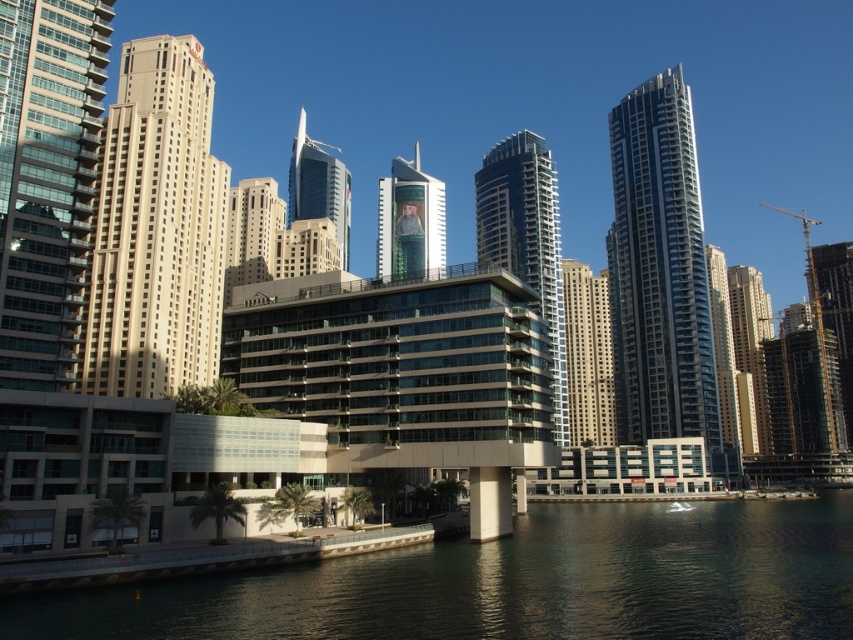
In the scene shown: You are an architect evaluating the urban waterfront scene. You need to determine which of the two central buildings, the metallic glass tower at center or the glassy steel skyscraper at center, has a lower height. Based on the scene, which one is shorter?

The metallic glass tower at center is shorter than the glassy steel skyscraper at center, so the metallic glass tower at center is the shorter one.

You are a city planner assessing the waterfront area. You need to install a new bench between the beige concrete building at left and the metallic glass tower at center. Considering their widths, which building would require a narrower bench to maintain a proportional design?

The beige concrete building at left has a lesser width compared to the metallic glass tower at center, so a narrower bench would be appropriate near the beige concrete building at left to maintain proportional design.

You are an architect analyzing the urban waterfront scene. You notice the glassy blue skyscraper at center and the metallic glass tower at center. Which one is positioned lower in the image?

The glassy blue skyscraper at center is positioned lower than the metallic glass tower at center in the image.